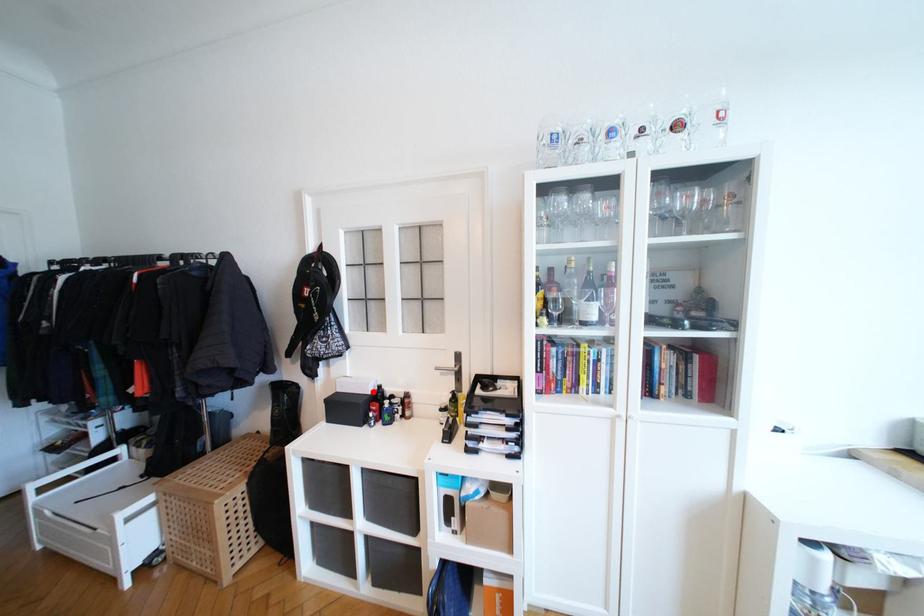
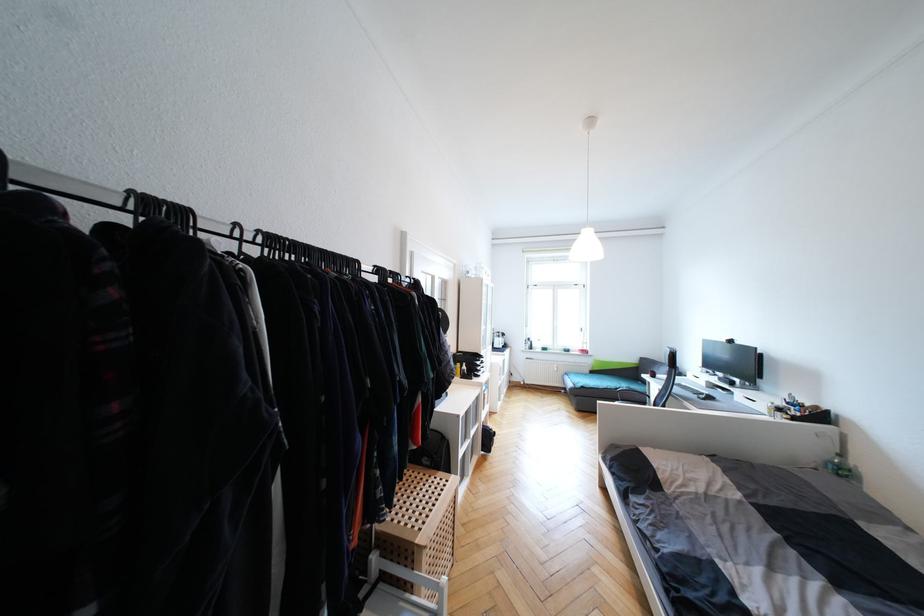
Question: I am providing you with two images of the same scene from different viewpoints. A red point is marked on the first image. Is the red point's position out of view in image 2?

Choices:
 (A) Yes
 (B) No

Answer: (A)